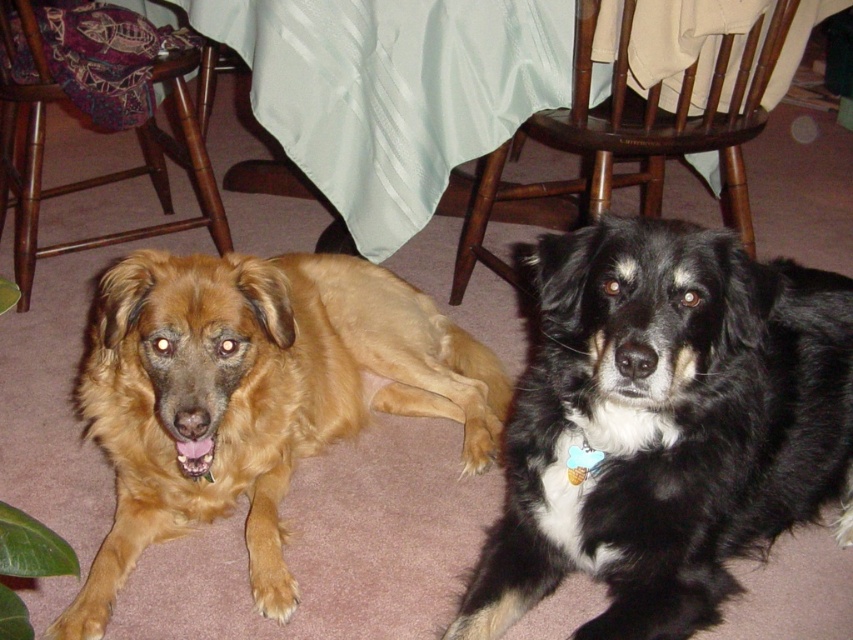
Does black/white fur dog at center appear on the left side of golden fur dog at left?

No, black/white fur dog at center is not to the left of golden fur dog at left.

Which of these two, black/white fur dog at center or golden fur dog at left, stands taller?

Standing taller between the two is golden fur dog at left.

Is point (567, 300) in front of point (480, 353)?

Yes.

Identify the location of black/white fur dog at center. (664, 426).

Is golden fur dog at left shorter than bamboo chair at lower left?

Indeed, golden fur dog at left has a lesser height compared to bamboo chair at lower left.

Is golden fur dog at left wider than bamboo chair at lower left?

Yes, golden fur dog at left is wider than bamboo chair at lower left.

Is point (335, 342) positioned behind point (143, 166)?

No, it is in front of (143, 166).

I want to click on golden fur dog at left, so click(254, 396).

Is point (677, 280) closer to camera compared to point (505, 275)?

Yes, it is in front of point (505, 275).

Can you confirm if black/white fur dog at center is thinner than wooden chair at center?

No, black/white fur dog at center is not thinner than wooden chair at center.

Does point (831, 461) come in front of point (730, 132)?

Yes, point (831, 461) is in front of point (730, 132).

This screenshot has height=640, width=853. What are the coordinates of `black/white fur dog at center` in the screenshot? It's located at (664, 426).